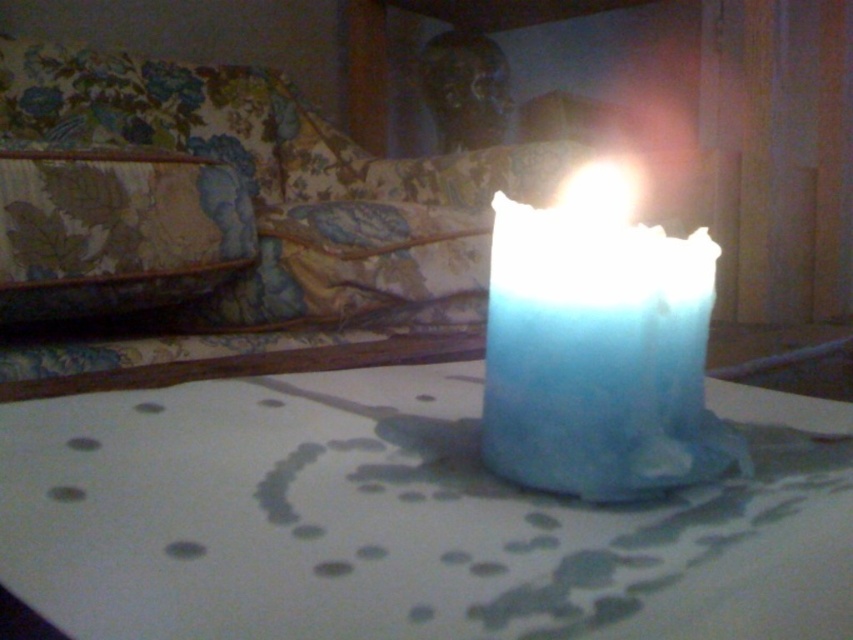
You are arranging a dinner table and have both the translucent glass candle at center and the blue wax candle at center. If you want to place them side by side on a narrow table runner that is only wide enough for one candle, which candle should you choose to ensure it fits better?

The translucent glass candle at center is wider than the blue wax candle at center. Therefore, the blue wax candle at center would fit better on the narrow table runner since it is narrower.

You are a guest at a dinner party and notice two candles on the table. The translucent glass candle at center and the blue wax candle at center. Which candle is positioned lower relative to the other?

The translucent glass candle at center is positioned below the blue wax candle at center, so it is lower.

You are positioning a camera to capture the translucent glass candle at center. The camera has a focal point set at coordinates 0.8, 0.5 on the image grid. Will the candle be in focus?

The translucent glass candle at center is located at point (403, 518), which is very close to the camera focal point at (426, 512). Therefore, the candle will be in focus.